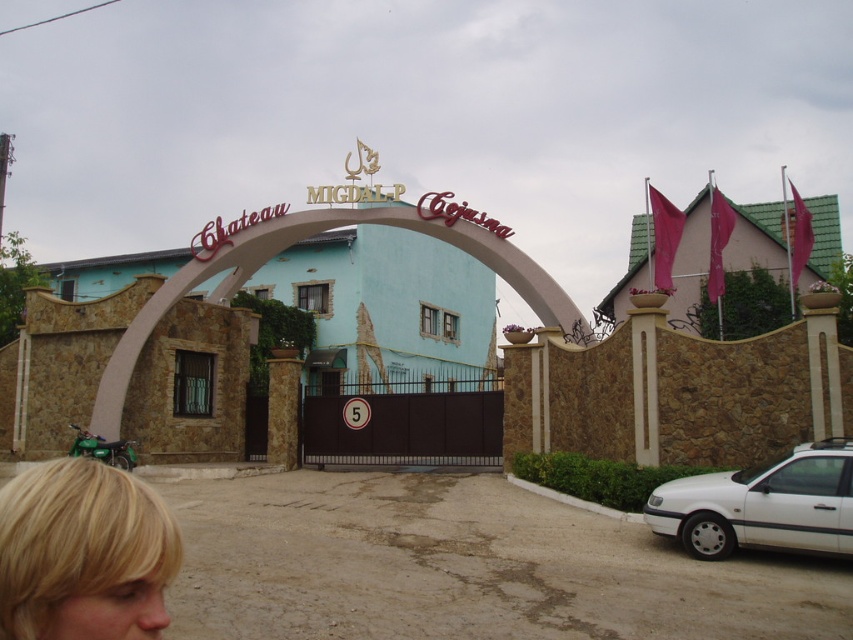
Is stone archway at center shorter than white matte car at lower right?

In fact, stone archway at center may be taller than white matte car at lower right.

Is stone archway at center thinner than white matte car at lower right?

No, stone archway at center is not thinner than white matte car at lower right.

The height and width of the screenshot is (640, 853). In order to click on stone archway at center in this screenshot , I will do `click(308, 236)`.

This screenshot has height=640, width=853. I want to click on stone archway at center, so point(308,236).

The width and height of the screenshot is (853, 640). What do you see at coordinates (83, 554) in the screenshot? I see `blonde hair at lower left` at bounding box center [83, 554].

Where is `blonde hair at lower left`? blonde hair at lower left is located at coordinates (83, 554).

Does stone archway at center have a smaller size compared to brown stone window at center?

Actually, stone archway at center might be larger than brown stone window at center.

Which is in front, point (292, 216) or point (190, 362)?

Point (292, 216) is more forward.

The height and width of the screenshot is (640, 853). Identify the location of stone archway at center. (308, 236).